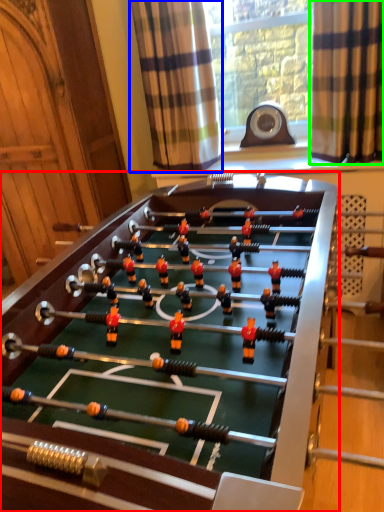
Question: Which object is positioned farthest from table (highlighted by a red box)? Select from curtain (highlighted by a blue box) and curtain (highlighted by a green box).

Choices:
 (A) curtain
 (B) curtain

Answer: (B)